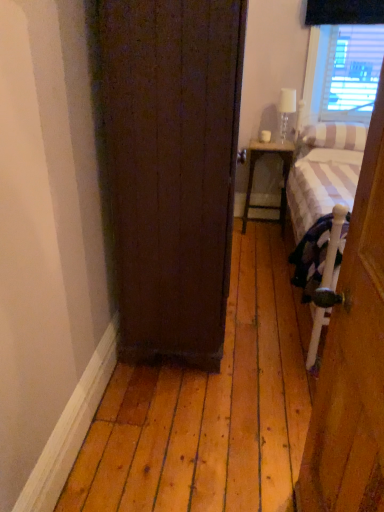
Question: Is white striped pillow at right, which is the second pillow in top-to-bottom order, oriented away from matte white wood nightstand at center?

Choices:
 (A) yes
 (B) no

Answer: (B)

Question: Is white striped pillow at right, which is the second pillow in top-to-bottom order, to the right of matte white wood nightstand at center from the viewer's perspective?

Choices:
 (A) no
 (B) yes

Answer: (B)

Question: Can matte white wood nightstand at center be found inside white striped pillow at right, which is the second pillow in top-to-bottom order?

Choices:
 (A) yes
 (B) no

Answer: (B)

Question: Does white striped pillow at right, which is the second pillow in top-to-bottom order, come in front of matte white wood nightstand at center?

Choices:
 (A) no
 (B) yes

Answer: (B)

Question: Is white striped pillow at right, which is the first pillow from bottom to top, facing towards matte white wood nightstand at center?

Choices:
 (A) no
 (B) yes

Answer: (A)

Question: From the image's perspective, would you say white striped pillow at right, which is the second pillow in top-to-bottom order, is positioned over matte white wood nightstand at center?

Choices:
 (A) no
 (B) yes

Answer: (B)

Question: Is matte white wood nightstand at center at the left side of dark wood door at center, which is the 2th door from right to left?

Choices:
 (A) yes
 (B) no

Answer: (B)

Question: Does matte white wood nightstand at center have a greater width compared to dark wood door at center, which is the 2th door from right to left?

Choices:
 (A) yes
 (B) no

Answer: (B)

Question: From the image's perspective, is matte white wood nightstand at center above dark wood door at center, which is the 2th door from right to left?

Choices:
 (A) yes
 (B) no

Answer: (A)

Question: From a real-world perspective, does matte white wood nightstand at center stand above dark wood door at center, placed as the 1th door when sorted from left to right?

Choices:
 (A) no
 (B) yes

Answer: (A)

Question: Could you tell me if matte white wood nightstand at center is facing dark wood door at center, arranged as the second door when viewed from the front?

Choices:
 (A) yes
 (B) no

Answer: (A)

Question: Can you confirm if matte white wood nightstand at center is taller than dark wood door at center, which is the 2th door from right to left?

Choices:
 (A) yes
 (B) no

Answer: (B)

Question: Does white striped pillow at right, the 1th pillow when ordered from top to bottom, appear on the left side of dark wood door at center, the 1th door in the back-to-front sequence?

Choices:
 (A) no
 (B) yes

Answer: (A)